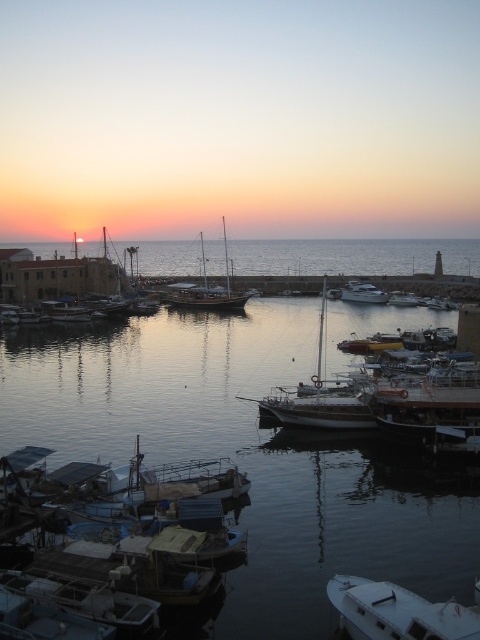
Question: Among these points, which one is nearest to the camera?

Choices:
 (A) (448, 618)
 (B) (92, 564)

Answer: (A)

Question: From the image, what is the correct spatial relationship of white matte boat at lower right in relation to white matte sailboat at center?

Choices:
 (A) above
 (B) below

Answer: (B)

Question: Among these objects, which one is farthest from the camera?

Choices:
 (A) wooden sailboat at center
 (B) white matte boat at lower right
 (C) white matte sailboat at center

Answer: (A)

Question: Does blue plastic boat at lower left have a larger size compared to white matte sailboat at center?

Choices:
 (A) yes
 (B) no

Answer: (B)

Question: Can you confirm if clear water at center is wider than white matte sailboat at center?

Choices:
 (A) yes
 (B) no

Answer: (A)

Question: Which object appears closest to the camera in this image?

Choices:
 (A) clear water at center
 (B) white matte sailboat at center
 (C) wooden sailboat at center
 (D) white matte boat at lower right

Answer: (D)